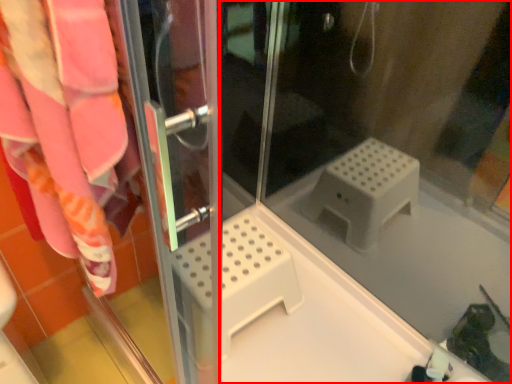
Question: Where is glass door (annotated by the red box) located in relation to screen door in the image?

Choices:
 (A) left
 (B) right

Answer: (B)